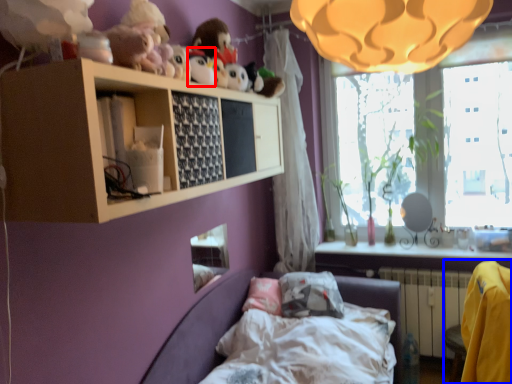
Question: Which point is closer to the camera, toy (highlighted by a red box) or armchair (highlighted by a blue box)?

Choices:
 (A) toy
 (B) armchair

Answer: (B)